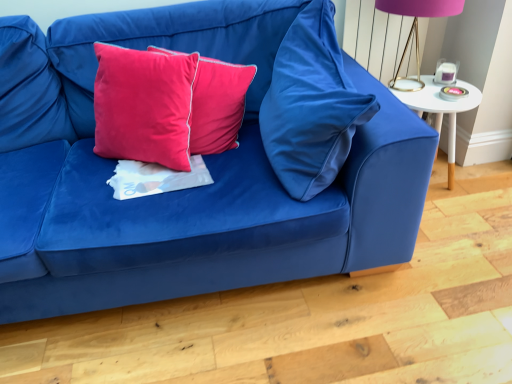
Question: In which direction should I rotate to look at velvet/cotton cushion at center, which is counted as the third pillow, starting from the right?

Choices:
 (A) left
 (B) right

Answer: (A)

Question: Is velvet/cotton cushion at center, which appears as the 1th pillow when viewed from the left, at the back of satin pink pillow at center, which is counted as the second pillow, starting from the left?

Choices:
 (A) no
 (B) yes

Answer: (A)

Question: Would you say velvet/cotton cushion at center, which is counted as the third pillow, starting from the right, is part of satin pink pillow at center, the second pillow when ordered from right to left,'s contents?

Choices:
 (A) yes
 (B) no

Answer: (B)

Question: Is satin pink pillow at center, the second pillow when ordered from right to left, positioned beyond the bounds of velvet/cotton cushion at center, which is counted as the third pillow, starting from the right?

Choices:
 (A) yes
 (B) no

Answer: (A)

Question: Is the position of satin pink pillow at center, which is counted as the second pillow, starting from the left, more distant than that of velvet/cotton cushion at center, which is counted as the third pillow, starting from the right?

Choices:
 (A) yes
 (B) no

Answer: (A)

Question: Is satin pink pillow at center, the second pillow when ordered from right to left, to the left of velvet/cotton cushion at center, which is counted as the third pillow, starting from the right, from the viewer's perspective?

Choices:
 (A) yes
 (B) no

Answer: (B)

Question: Does satin pink pillow at center, the second pillow when ordered from right to left, have a smaller size compared to velvet/cotton cushion at center, which is counted as the third pillow, starting from the right?

Choices:
 (A) yes
 (B) no

Answer: (A)

Question: Is velvet/cotton cushion at center, which appears as the 1th pillow when viewed from the left, to the right of satin pink pillow at center, the second pillow when ordered from right to left, from the viewer's perspective?

Choices:
 (A) no
 (B) yes

Answer: (A)

Question: Is velvet/cotton cushion at center, which appears as the 1th pillow when viewed from the left, surrounding satin pink pillow at center, which is counted as the second pillow, starting from the left?

Choices:
 (A) yes
 (B) no

Answer: (B)

Question: Is velvet/cotton cushion at center, which appears as the 1th pillow when viewed from the left, taller than satin pink pillow at center, the second pillow when ordered from right to left?

Choices:
 (A) no
 (B) yes

Answer: (B)

Question: Is velvet/cotton cushion at center, which is counted as the third pillow, starting from the right, next to satin pink pillow at center, which is counted as the second pillow, starting from the left?

Choices:
 (A) no
 (B) yes

Answer: (A)

Question: Is there a large distance between velvet/cotton cushion at center, which appears as the 1th pillow when viewed from the left, and satin pink pillow at center, which is counted as the second pillow, starting from the left?

Choices:
 (A) no
 (B) yes

Answer: (A)

Question: From a real-world perspective, is velvet/cotton cushion at center, which is counted as the third pillow, starting from the right, physically below satin pink pillow at center, which is counted as the second pillow, starting from the left?

Choices:
 (A) no
 (B) yes

Answer: (A)

Question: From the image's perspective, is velvet blue couch at center over white glossy side table at right?

Choices:
 (A) no
 (B) yes

Answer: (A)